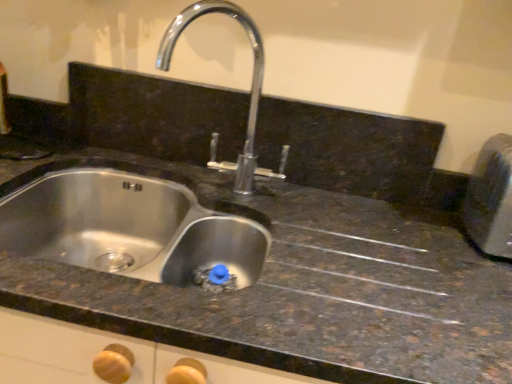
You are a GUI agent. You are given a task and a screenshot of the screen. Output one action in this format:
    pyautogui.click(x=<x>, y=<y>)
    Task: Click on the metallic silver toaster at right
    This screenshot has width=512, height=384.
    Given the screenshot: What is the action you would take?
    pyautogui.click(x=490, y=198)

Is stainless steel sink at center at the back of polished chrome tap at center?

That's not correct — polished chrome tap at center is not looking away from stainless steel sink at center.

From a real-world perspective, is polished chrome tap at center on top of stainless steel sink at center?

Correct, in the physical world, polished chrome tap at center is higher than stainless steel sink at center.

Considering the sizes of objects polished chrome tap at center and stainless steel sink at center in the image provided, who is thinner, polished chrome tap at center or stainless steel sink at center?

Thinner between the two is polished chrome tap at center.

Is polished chrome tap at center next to metallic silver toaster at right?

No, polished chrome tap at center is not in contact with metallic silver toaster at right.

Which object is further away from the camera, polished chrome tap at center or metallic silver toaster at right?

metallic silver toaster at right is further from the camera.

Is polished chrome tap at center to the left of metallic silver toaster at right from the viewer's perspective?

Yes.

Who is bigger, polished chrome tap at center or metallic silver toaster at right?

polished chrome tap at center is bigger.

Is stainless steel sink at center facing away from metallic silver toaster at right?

No, metallic silver toaster at right is not at the back of stainless steel sink at center.

Based on the photo, considering the sizes of objects stainless steel sink at center and metallic silver toaster at right in the image provided, who is taller, stainless steel sink at center or metallic silver toaster at right?

With more height is stainless steel sink at center.

From the image's perspective, between stainless steel sink at center and metallic silver toaster at right, which one is located above?

From the image's view, metallic silver toaster at right is above.

Can you confirm if metallic silver toaster at right is smaller than stainless steel sink at center?

Correct, metallic silver toaster at right occupies less space than stainless steel sink at center.

In the scene shown: Is metallic silver toaster at right touching stainless steel sink at center?

There is a gap between metallic silver toaster at right and stainless steel sink at center.

Based on the photo, from the image's perspective, is metallic silver toaster at right on stainless steel sink at center?

Yes, from the image's perspective, metallic silver toaster at right is above stainless steel sink at center.

In the scene shown: Is the position of stainless steel sink at center more distant than that of polished chrome tap at center?

That is False.

Find the location of a particular element. The image size is (512, 384). sink that is below the polished chrome tap at center (from the image's perspective) is located at coordinates (129, 222).

Can you confirm if stainless steel sink at center is shorter than polished chrome tap at center?

Yes.

Could you tell me if metallic silver toaster at right is turned towards polished chrome tap at center?

No, metallic silver toaster at right is not aimed at polished chrome tap at center.

In the scene shown: From a real-world perspective, is metallic silver toaster at right above or below polished chrome tap at center?

metallic silver toaster at right is below polished chrome tap at center.

Is metallic silver toaster at right surrounding polished chrome tap at center?

No, metallic silver toaster at right does not contain polished chrome tap at center.

This screenshot has width=512, height=384. I want to click on sink on the left of the polished chrome tap at center, so click(x=129, y=222).

Image resolution: width=512 pixels, height=384 pixels. There is a metallic silver toaster at right. Identify the location of tap above it (from a real-world perspective). (251, 90).

From the image, which object appears to be farther from metallic silver toaster at right, polished chrome tap at center or stainless steel sink at center?

Among the two, stainless steel sink at center is located further to metallic silver toaster at right.

Based on their spatial positions, is metallic silver toaster at right or stainless steel sink at center further from polished chrome tap at center?

Among the two, metallic silver toaster at right is located further to polished chrome tap at center.

When comparing their distances from polished chrome tap at center, does stainless steel sink at center or metallic silver toaster at right seem closer?

stainless steel sink at center.

Looking at the image, which one is located further to stainless steel sink at center, metallic silver toaster at right or polished chrome tap at center?

metallic silver toaster at right is positioned further to the anchor stainless steel sink at center.

Considering their positions, is stainless steel sink at center positioned closer to metallic silver toaster at right than polished chrome tap at center?

Among the two, polished chrome tap at center is located nearer to metallic silver toaster at right.

Considering their positions, is polished chrome tap at center positioned closer to stainless steel sink at center than metallic silver toaster at right?

polished chrome tap at center lies closer to stainless steel sink at center than the other object.

I want to click on tap located between stainless steel sink at center and metallic silver toaster at right in the left-right direction, so click(x=251, y=90).